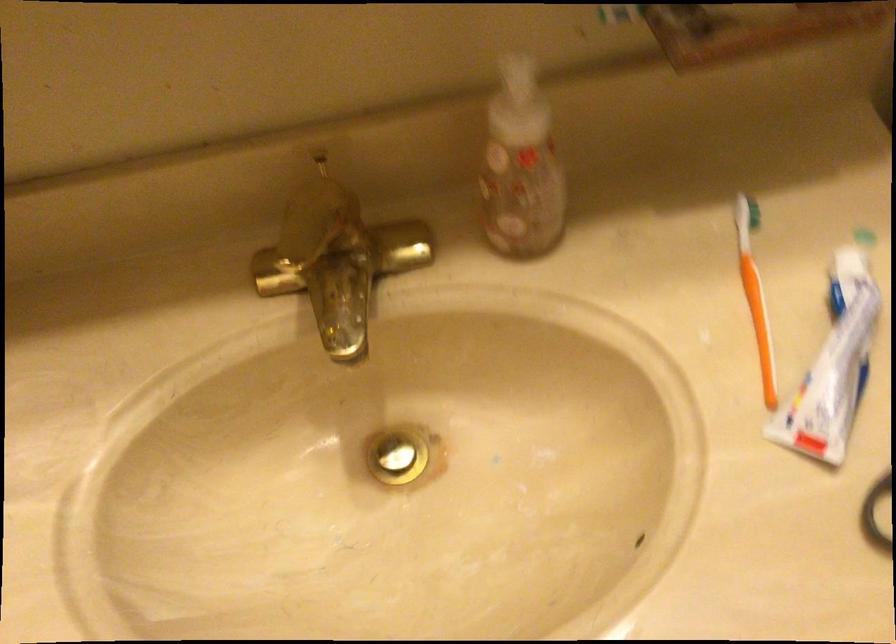
Find where to push the sink drain stopper. Please return your answer as a coordinate pair (x, y).

(392, 456)